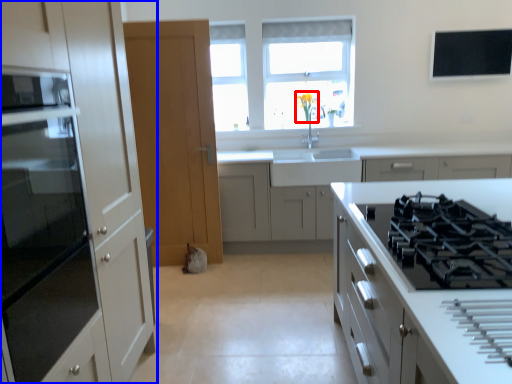
Question: Among these objects, which one is nearest to the camera, flower (highlighted by a red box) or cabinetry (highlighted by a blue box)?

Choices:
 (A) flower
 (B) cabinetry

Answer: (B)